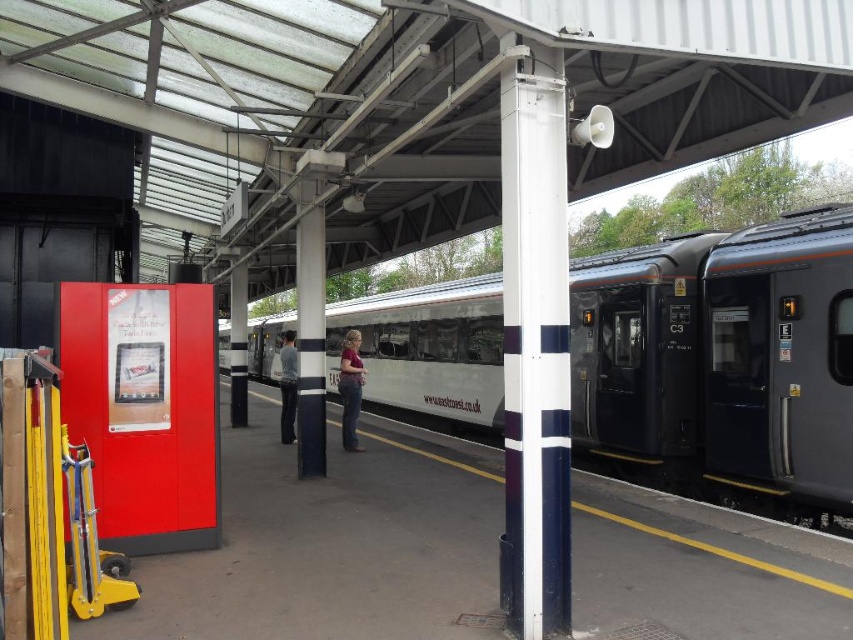
How distant is silver metallic train at center from white painted metal pole at center?

silver metallic train at center is 10.52 meters from white painted metal pole at center.

This screenshot has height=640, width=853. Describe the element at coordinates (723, 358) in the screenshot. I see `silver metallic train at center` at that location.

I want to click on silver metallic train at center, so click(723, 358).

Find the location of a particular element. silver metallic train at center is located at coordinates (723, 358).

Which is more to the left, white painted metal pole at center or matte pink shirt at center?

From the viewer's perspective, matte pink shirt at center appears more on the left side.

The width and height of the screenshot is (853, 640). What are the coordinates of `white painted metal pole at center` in the screenshot? It's located at (535, 346).

This screenshot has width=853, height=640. What are the coordinates of `white painted metal pole at center` in the screenshot? It's located at (535, 346).

Can you confirm if white painted metal pole at center is positioned below dark gray jeans at center?

No.

The image size is (853, 640). What do you see at coordinates (535, 346) in the screenshot?
I see `white painted metal pole at center` at bounding box center [535, 346].

Identify the location of white painted metal pole at center. (535, 346).

Find the location of a particular element. This screenshot has height=640, width=853. white painted metal pole at center is located at coordinates pos(535,346).